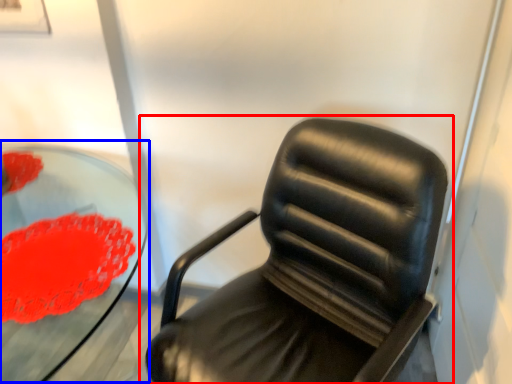
Question: Among these objects, which one is nearest to the camera, chair (highlighted by a red box) or round table (highlighted by a blue box)?

Choices:
 (A) chair
 (B) round table

Answer: (A)